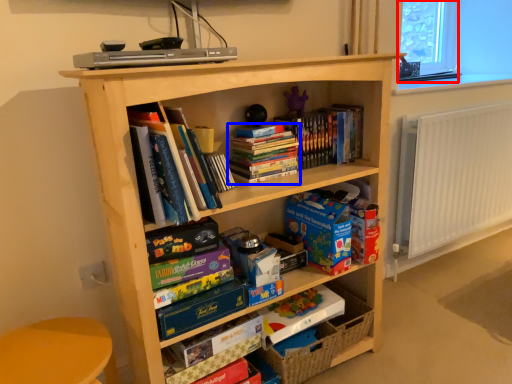
Question: Which of the following is the closest to the observer, window screen (highlighted by a red box) or book (highlighted by a blue box)?

Choices:
 (A) window screen
 (B) book

Answer: (B)